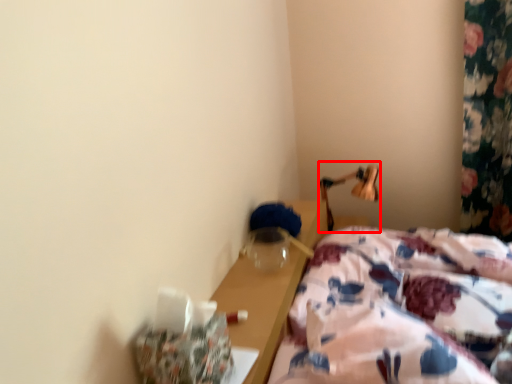
Question: Considering the relative positions of bedside lamp (annotated by the red box) and bed in the image provided, where is bedside lamp (annotated by the red box) located with respect to the staircase?

Choices:
 (A) right
 (B) left

Answer: (A)